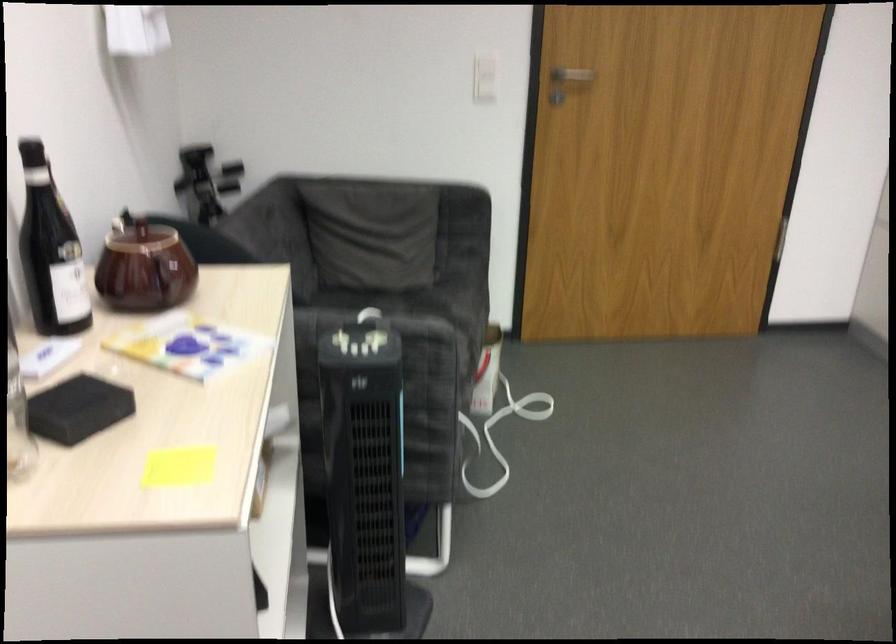
Find where to push the white light switch. Please return your answer as a coordinate pair (x, y).

(484, 77)